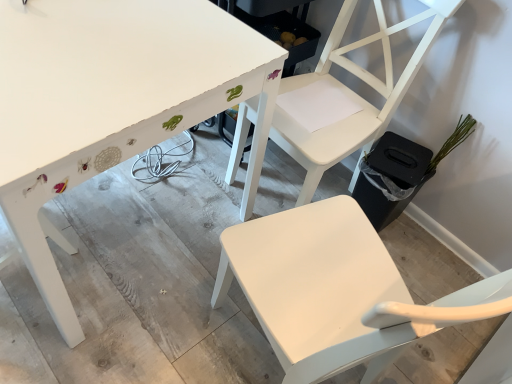
Locate an element on the screen. free space to the left of white matte chair at upper center, positioned as the 2th chair in top-to-bottom order is located at coordinates (164, 330).